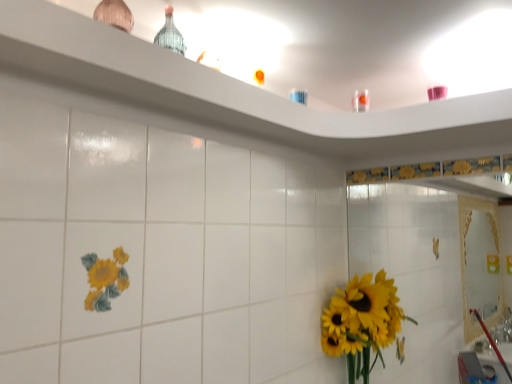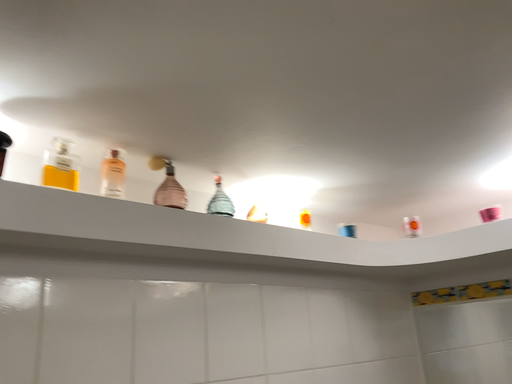
Question: How did the camera likely rotate when shooting the video?

Choices:
 (A) rotated left
 (B) rotated right

Answer: (A)